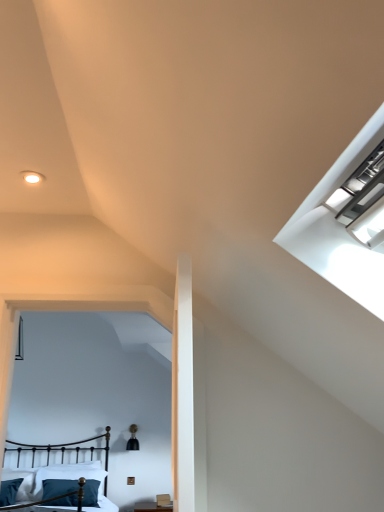
What do you see at coordinates (61, 487) in the screenshot? I see `black wrought iron bed at lower left` at bounding box center [61, 487].

The height and width of the screenshot is (512, 384). Identify the location of teal velvet pillow at lower left, the second pillow viewed from the right. (9, 490).

Is teal fabric pillow at lower left, which is the 1th pillow in right-to-left order, facing towards teal velvet pillow at lower left, the first pillow viewed from the left?

No, teal fabric pillow at lower left, which is the 1th pillow in right-to-left order, is not facing towards teal velvet pillow at lower left, the first pillow viewed from the left.

Is teal fabric pillow at lower left, which is the 1th pillow in right-to-left order, next to teal velvet pillow at lower left, the first pillow viewed from the left?

There is a gap between teal fabric pillow at lower left, which is the 1th pillow in right-to-left order, and teal velvet pillow at lower left, the first pillow viewed from the left.

Is teal fabric pillow at lower left, which is the 1th pillow in right-to-left order, in front of teal velvet pillow at lower left, the second pillow viewed from the right?

No, teal fabric pillow at lower left, which is the 1th pillow in right-to-left order, is further to the viewer.

Is teal velvet pillow at lower left, the second pillow viewed from the right, a part of teal fabric pillow at lower left, acting as the 2th pillow starting from the left?

No.

Between black wrought iron bed at lower left and teal fabric pillow at lower left, acting as the 2th pillow starting from the left, which one has smaller size?

With smaller size is teal fabric pillow at lower left, acting as the 2th pillow starting from the left.

Does point (107, 508) appear closer or farther from the camera than point (57, 492)?

Clearly, point (107, 508) is more distant from the camera than point (57, 492).

Does black wrought iron bed at lower left turn towards teal fabric pillow at lower left, acting as the 2th pillow starting from the left?

No, black wrought iron bed at lower left is not aimed at teal fabric pillow at lower left, acting as the 2th pillow starting from the left.

Would you say black wrought iron bed at lower left is inside or outside teal fabric pillow at lower left, acting as the 2th pillow starting from the left?

black wrought iron bed at lower left cannot be found inside teal fabric pillow at lower left, acting as the 2th pillow starting from the left.

This screenshot has width=384, height=512. Find the location of `bed in front of the teal velvet pillow at lower left, the first pillow viewed from the left`. bed in front of the teal velvet pillow at lower left, the first pillow viewed from the left is located at coordinates (61, 487).

How different are the orientations of teal velvet pillow at lower left, the first pillow viewed from the left, and black wrought iron bed at lower left in degrees?

There is a 4.31-degree angle between the facing directions of teal velvet pillow at lower left, the first pillow viewed from the left, and black wrought iron bed at lower left.

Measure the distance from teal velvet pillow at lower left, the first pillow viewed from the left, to black wrought iron bed at lower left.

teal velvet pillow at lower left, the first pillow viewed from the left, is 21.94 inches from black wrought iron bed at lower left.

Looking at their sizes, would you say teal velvet pillow at lower left, the first pillow viewed from the left, is wider or thinner than black wrought iron bed at lower left?

In the image, teal velvet pillow at lower left, the first pillow viewed from the left, appears to be more narrow than black wrought iron bed at lower left.

Find the location of a particular element. bed above the teal fabric pillow at lower left, acting as the 2th pillow starting from the left (from the image's perspective) is located at coordinates (61, 487).

Considering the relative sizes of teal fabric pillow at lower left, which is the 1th pillow in right-to-left order, and black wrought iron bed at lower left in the image provided, is teal fabric pillow at lower left, which is the 1th pillow in right-to-left order, taller than black wrought iron bed at lower left?

In fact, teal fabric pillow at lower left, which is the 1th pillow in right-to-left order, may be shorter than black wrought iron bed at lower left.

Are teal fabric pillow at lower left, acting as the 2th pillow starting from the left, and black wrought iron bed at lower left beside each other?

teal fabric pillow at lower left, acting as the 2th pillow starting from the left, and black wrought iron bed at lower left are not in contact.

From the image's perspective, which object appears higher, teal fabric pillow at lower left, which is the 1th pillow in right-to-left order, or black wrought iron bed at lower left?

black wrought iron bed at lower left.

Who is more distant, black wrought iron bed at lower left or teal velvet pillow at lower left, the second pillow viewed from the right?

Positioned behind is teal velvet pillow at lower left, the second pillow viewed from the right.

Considering the sizes of objects black wrought iron bed at lower left and teal velvet pillow at lower left, the second pillow viewed from the right, in the image provided, who is shorter, black wrought iron bed at lower left or teal velvet pillow at lower left, the second pillow viewed from the right,?

teal velvet pillow at lower left, the second pillow viewed from the right, is shorter.

Is black wrought iron bed at lower left turned away from teal velvet pillow at lower left, the first pillow viewed from the left?

No.

Can you confirm if black wrought iron bed at lower left is thinner than teal velvet pillow at lower left, the second pillow viewed from the right?

Incorrect, the width of black wrought iron bed at lower left is not less than that of teal velvet pillow at lower left, the second pillow viewed from the right.

Is teal velvet pillow at lower left, the second pillow viewed from the right, not near teal fabric pillow at lower left, which is the 1th pillow in right-to-left order?

teal velvet pillow at lower left, the second pillow viewed from the right, is near teal fabric pillow at lower left, which is the 1th pillow in right-to-left order, not far away.

Consider the image. From their relative heights in the image, would you say teal velvet pillow at lower left, the first pillow viewed from the left, is taller or shorter than teal fabric pillow at lower left, acting as the 2th pillow starting from the left?

Clearly, teal velvet pillow at lower left, the first pillow viewed from the left, is shorter compared to teal fabric pillow at lower left, acting as the 2th pillow starting from the left.

Find the location of a particular element. The height and width of the screenshot is (512, 384). pillow positioned vertically above the teal fabric pillow at lower left, which is the 1th pillow in right-to-left order (from a real-world perspective) is located at coordinates click(9, 490).

Is teal velvet pillow at lower left, the first pillow viewed from the left, to the left of teal fabric pillow at lower left, which is the 1th pillow in right-to-left order, from the viewer's perspective?

Indeed, teal velvet pillow at lower left, the first pillow viewed from the left, is positioned on the left side of teal fabric pillow at lower left, which is the 1th pillow in right-to-left order.

What are the coordinates of `pillow below the teal velvet pillow at lower left, the second pillow viewed from the right (from the image's perspective)` in the screenshot? It's located at (60, 492).

Find the location of a particular element. bed above the teal fabric pillow at lower left, which is the 1th pillow in right-to-left order (from a real-world perspective) is located at coordinates (61, 487).

Estimate the real-world distances between objects in this image. Which object is closer to teal velvet pillow at lower left, the second pillow viewed from the right, black wrought iron bed at lower left or teal fabric pillow at lower left, acting as the 2th pillow starting from the left?

teal fabric pillow at lower left, acting as the 2th pillow starting from the left, is positioned closer to the anchor teal velvet pillow at lower left, the second pillow viewed from the right.

Looking at the image, which one is located further to teal velvet pillow at lower left, the first pillow viewed from the left, teal fabric pillow at lower left, acting as the 2th pillow starting from the left, or black wrought iron bed at lower left?

Based on the image, black wrought iron bed at lower left appears to be further to teal velvet pillow at lower left, the first pillow viewed from the left.

When comparing their distances from teal fabric pillow at lower left, acting as the 2th pillow starting from the left, does black wrought iron bed at lower left or teal velvet pillow at lower left, the first pillow viewed from the left, seem closer?

black wrought iron bed at lower left.

Estimate the real-world distances between objects in this image. Which object is closer to black wrought iron bed at lower left, teal velvet pillow at lower left, the first pillow viewed from the left, or teal fabric pillow at lower left, acting as the 2th pillow starting from the left?

teal fabric pillow at lower left, acting as the 2th pillow starting from the left.

When comparing their distances from black wrought iron bed at lower left, does teal fabric pillow at lower left, which is the 1th pillow in right-to-left order, or teal velvet pillow at lower left, the first pillow viewed from the left, seem further?

teal velvet pillow at lower left, the first pillow viewed from the left, is positioned further to the anchor black wrought iron bed at lower left.

From the image, which object appears to be nearer to teal fabric pillow at lower left, acting as the 2th pillow starting from the left, teal velvet pillow at lower left, the first pillow viewed from the left, or black wrought iron bed at lower left?

black wrought iron bed at lower left is positioned closer to the anchor teal fabric pillow at lower left, acting as the 2th pillow starting from the left.

The image size is (384, 512). Find the location of `pillow between black wrought iron bed at lower left and teal fabric pillow at lower left, acting as the 2th pillow starting from the left, in the front-back direction`. pillow between black wrought iron bed at lower left and teal fabric pillow at lower left, acting as the 2th pillow starting from the left, in the front-back direction is located at coordinates (9, 490).